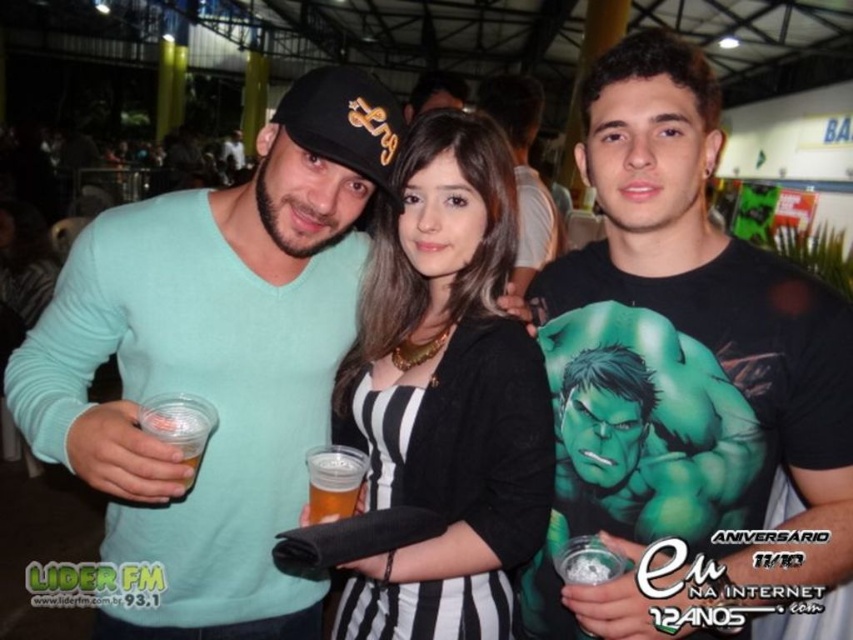
Who is lower down, black matte t-shirt at center or green matte hulk shirt at center?

black matte t-shirt at center is below.

From the picture: Is black matte t-shirt at center below green matte hulk shirt at center?

Yes, black matte t-shirt at center is below green matte hulk shirt at center.

What do you see at coordinates (682, 378) in the screenshot? This screenshot has height=640, width=853. I see `black matte t-shirt at center` at bounding box center [682, 378].

Where is `black matte t-shirt at center`? black matte t-shirt at center is located at coordinates (682, 378).

Who is shorter, black matte t-shirt at center or green fabric hulk at center?

green fabric hulk at center is shorter.

Is black matte t-shirt at center to the right of green fabric hulk at center from the viewer's perspective?

Correct, you'll find black matte t-shirt at center to the right of green fabric hulk at center.

I want to click on black matte t-shirt at center, so click(x=682, y=378).

Does black matte t-shirt at center appear over matte teal sweater at center?

Yes.

Can you confirm if black matte t-shirt at center is taller than matte teal sweater at center?

Incorrect, black matte t-shirt at center's height is not larger of matte teal sweater at center's.

Find the location of a particular element. black matte t-shirt at center is located at coordinates (682, 378).

You are a GUI agent. You are given a task and a screenshot of the screen. Output one action in this format:
    pyautogui.click(x=<x>, y=<y>)
    Task: Click on the black matte t-shirt at center
    The image size is (853, 640).
    Given the screenshot: What is the action you would take?
    pyautogui.click(x=682, y=378)